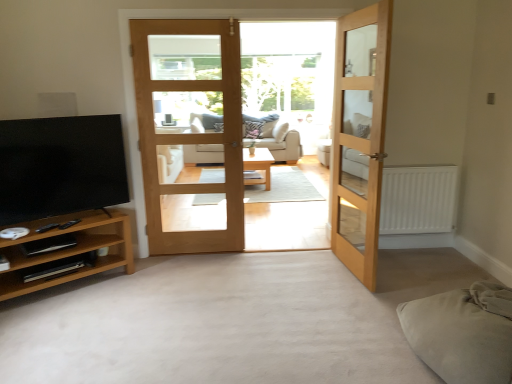
Question: Is matte black tv at left not near light oak wooden door at center, the second door when ordered from right to left?

Choices:
 (A) no
 (B) yes

Answer: (A)

Question: Could you tell me if matte black tv at left is turned towards light oak wooden door at center, marked as the 1th door in a left-to-right arrangement?

Choices:
 (A) no
 (B) yes

Answer: (A)

Question: Can you confirm if matte black tv at left is shorter than light oak wooden door at center, the second door when ordered from right to left?

Choices:
 (A) yes
 (B) no

Answer: (A)

Question: From the image's perspective, is matte black tv at left located beneath light oak wooden door at center, the second door when ordered from right to left?

Choices:
 (A) yes
 (B) no

Answer: (A)

Question: Are matte black tv at left and light oak wooden door at center, marked as the 1th door in a left-to-right arrangement, making contact?

Choices:
 (A) yes
 (B) no

Answer: (B)

Question: Considering the relative sizes of matte black tv at left and light oak wooden door at center, marked as the 1th door in a left-to-right arrangement, in the image provided, is matte black tv at left thinner than light oak wooden door at center, marked as the 1th door in a left-to-right arrangement,?

Choices:
 (A) no
 (B) yes

Answer: (A)

Question: Does light oak wooden door at center, the second door when ordered from right to left, have a greater height compared to clear glass door at center?

Choices:
 (A) no
 (B) yes

Answer: (A)

Question: Does light oak wooden door at center, the second door when ordered from right to left, touch clear glass door at center?

Choices:
 (A) yes
 (B) no

Answer: (B)

Question: Is light oak wooden door at center, the second door when ordered from right to left, positioned with its back to clear glass door at center?

Choices:
 (A) yes
 (B) no

Answer: (A)

Question: Is light oak wooden door at center, the second door when ordered from right to left, at the left side of clear glass door at center?

Choices:
 (A) no
 (B) yes

Answer: (B)

Question: Is light oak wooden door at center, the second door when ordered from right to left, positioned in front of clear glass door at center?

Choices:
 (A) no
 (B) yes

Answer: (B)

Question: Does light oak wooden door at center, the second door when ordered from right to left, turn towards clear glass door at center?

Choices:
 (A) no
 (B) yes

Answer: (A)

Question: Is light oak wooden door at center, marked as the 1th door in a left-to-right arrangement, aimed at beige fabric studio couch at center?

Choices:
 (A) yes
 (B) no

Answer: (B)